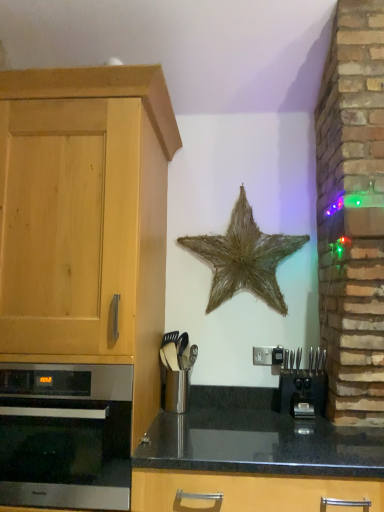
Question: From their relative heights in the image, would you say metallic silver utensil holder at center is taller or shorter than black granite countertop at center?

Choices:
 (A) tall
 (B) short

Answer: (B)

Question: Based on their positions, is metallic silver utensil holder at center located to the left or right of black granite countertop at center?

Choices:
 (A) left
 (B) right

Answer: (A)

Question: Which object is the farthest from the black plastic coffee machine at lower right?

Choices:
 (A) satin silver oven at left
 (B) light wood cabinet at left
 (C) rustic straw star at center
 (D) metallic silver utensil holder at center
 (E) black granite countertop at center

Answer: (B)

Question: Which of these objects is positioned closest to the rustic straw star at center?

Choices:
 (A) satin silver oven at left
 (B) black granite countertop at center
 (C) metallic silver utensil holder at center
 (D) light wood cabinet at left
 (E) black plastic coffee machine at lower right

Answer: (C)